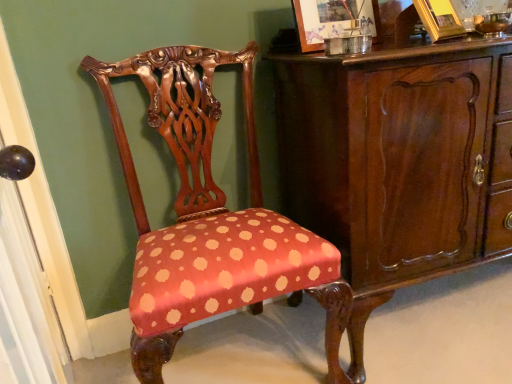
Question: Is polka dot fabric chair at center situated inside mahogany wood cabinet at center or outside?

Choices:
 (A) inside
 (B) outside

Answer: (B)

Question: Is polka dot fabric chair at center taller or shorter than mahogany wood cabinet at center?

Choices:
 (A) short
 (B) tall

Answer: (B)

Question: Which object is the farthest from the polka dot fabric chair at center?

Choices:
 (A) mahogany wood cabinet at center
 (B) wooden picture frame at upper center, positioned as the first picture frame in left-to-right order
 (C) gold metallic picture frame at upper right, which appears as the 1th picture frame when viewed from the right

Answer: (C)

Question: Which of these objects is positioned farthest from the gold metallic picture frame at upper right, positioned as the 2th picture frame in left-to-right order?

Choices:
 (A) polka dot fabric chair at center
 (B) wooden picture frame at upper center, which appears as the second picture frame when viewed from the right
 (C) mahogany wood cabinet at center

Answer: (A)